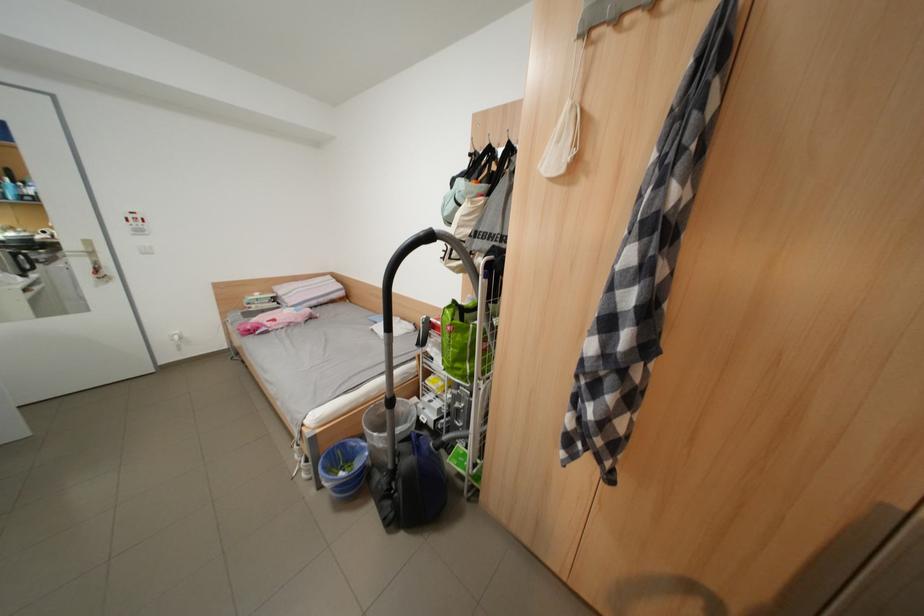
Where would you push the control panel button? Please return your answer as a coordinate pair (x, y).

(136, 223)